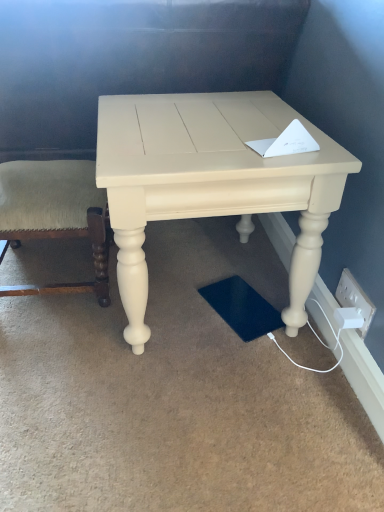
Describe the element at coordinates (210, 181) in the screenshot. The height and width of the screenshot is (512, 384). I see `matte cream table at center` at that location.

You are a GUI agent. You are given a task and a screenshot of the screen. Output one action in this format:
    pyautogui.click(x=<x>, y=<y>)
    Task: Click on the white plastic socket at lower right
    The height and width of the screenshot is (512, 384).
    Given the screenshot: What is the action you would take?
    pyautogui.click(x=349, y=317)

The height and width of the screenshot is (512, 384). I want to click on white plastic electric outlet at lower right, so click(355, 298).

From the image's perspective, is green fabric cushion at left under white plastic electric outlet at lower right?

No.

I want to click on electric outlet below the green fabric cushion at left (from the image's perspective), so click(355, 298).

Considering the sizes of green fabric cushion at left and white plastic electric outlet at lower right in the image, is green fabric cushion at left bigger or smaller than white plastic electric outlet at lower right?

Clearly, green fabric cushion at left is larger in size than white plastic electric outlet at lower right.

Is white plastic electric outlet at lower right bigger than green fabric cushion at left?

No.

From the image's perspective, does white plastic electric outlet at lower right appear lower than green fabric cushion at left?

Yes.

Is white plastic electric outlet at lower right inside the boundaries of green fabric cushion at left, or outside?

white plastic electric outlet at lower right is not inside green fabric cushion at left, it's outside.

From a real-world perspective, is white plastic electric outlet at lower right below green fabric cushion at left?

Incorrect, from a real-world perspective, white plastic electric outlet at lower right is higher than green fabric cushion at left.

Is white plastic electric outlet at lower right at the back of white plastic socket at lower right?

Yes.

From a real-world perspective, is white plastic socket at lower right above or below white plastic electric outlet at lower right?

In terms of real-world spatial position, white plastic socket at lower right is below white plastic electric outlet at lower right.

Is point (358, 311) positioned in front of point (355, 293)?

Yes, point (358, 311) is in front of point (355, 293).

Who is bigger, white plastic socket at lower right or white plastic electric outlet at lower right?

Bigger between the two is white plastic electric outlet at lower right.

Can you tell me how much white plastic electric outlet at lower right and matte cream table at center differ in facing direction?

0.982 degrees separate the facing orientations of white plastic electric outlet at lower right and matte cream table at center.

The width and height of the screenshot is (384, 512). What are the coordinates of `electric outlet below the matte cream table at center (from a real-world perspective)` in the screenshot? It's located at (355, 298).

Does white plastic electric outlet at lower right have a greater width compared to matte cream table at center?

No, white plastic electric outlet at lower right is not wider than matte cream table at center.

Considering the positions of points (366, 325) and (133, 287), is point (366, 325) farther from camera compared to point (133, 287)?

Yes, point (366, 325) is farther from viewer.

Is white plastic electric outlet at lower right facing away from white plastic socket at lower right?

Absolutely, white plastic electric outlet at lower right is directed away from white plastic socket at lower right.

From the picture: Between white plastic electric outlet at lower right and white plastic socket at lower right, which one has more height?

Standing taller between the two is white plastic electric outlet at lower right.

From the image's perspective, is white plastic electric outlet at lower right located above or below white plastic socket at lower right?

Clearly, from the image's perspective, white plastic electric outlet at lower right is above white plastic socket at lower right.

Is white plastic electric outlet at lower right wider than white plastic socket at lower right?

Incorrect, the width of white plastic electric outlet at lower right does not surpass that of white plastic socket at lower right.

Based on their sizes in the image, would you say matte cream table at center is bigger or smaller than white plastic electric outlet at lower right?

Clearly, matte cream table at center is larger in size than white plastic electric outlet at lower right.

Which of these two, matte cream table at center or white plastic electric outlet at lower right, is thinner?

Thinner between the two is white plastic electric outlet at lower right.

Does point (325, 169) come in front of point (348, 292)?

Yes, it is in front of point (348, 292).

Can you confirm if matte cream table at center is positioned to the left of white plastic electric outlet at lower right?

Correct, you'll find matte cream table at center to the left of white plastic electric outlet at lower right.

In the scene shown: Considering the sizes of white plastic socket at lower right and green fabric cushion at left in the image, is white plastic socket at lower right wider or thinner than green fabric cushion at left?

white plastic socket at lower right is thinner than green fabric cushion at left.

You are a GUI agent. You are given a task and a screenshot of the screen. Output one action in this format:
    pyautogui.click(x=<x>, y=<y>)
    Task: Click on the socket that appears below the green fabric cushion at left (from a real-world perspective)
    The height and width of the screenshot is (512, 384).
    Given the screenshot: What is the action you would take?
    pyautogui.click(x=349, y=317)

Does white plastic socket at lower right turn towards green fabric cushion at left?

No.

The image size is (384, 512). Find the location of `chair below the white plastic electric outlet at lower right (from a real-world perspective)`. chair below the white plastic electric outlet at lower right (from a real-world perspective) is located at coordinates (56, 208).

Find the location of a particular element. The width and height of the screenshot is (384, 512). electric outlet that appears below the green fabric cushion at left (from the image's perspective) is located at coordinates (355, 298).

When comparing their distances from white plastic electric outlet at lower right, does matte cream table at center or white plastic socket at lower right seem further?

Based on the image, matte cream table at center appears to be further to white plastic electric outlet at lower right.

Based on their spatial positions, is green fabric cushion at left or matte cream table at center closer to white plastic electric outlet at lower right?

matte cream table at center is closer to white plastic electric outlet at lower right.

From the image, which object appears to be farther from white plastic socket at lower right, green fabric cushion at left or white plastic electric outlet at lower right?

Based on the image, green fabric cushion at left appears to be further to white plastic socket at lower right.

Looking at the image, which one is located further to matte cream table at center, white plastic socket at lower right or green fabric cushion at left?

white plastic socket at lower right is positioned further to the anchor matte cream table at center.

Estimate the real-world distances between objects in this image. Which object is closer to white plastic electric outlet at lower right, white plastic socket at lower right or green fabric cushion at left?

The object closer to white plastic electric outlet at lower right is white plastic socket at lower right.

Looking at the image, which one is located further to green fabric cushion at left, matte cream table at center or white plastic socket at lower right?

white plastic socket at lower right is positioned further to the anchor green fabric cushion at left.

In the scene shown: When comparing their distances from white plastic electric outlet at lower right, does white plastic socket at lower right or matte cream table at center seem closer?

Among the two, white plastic socket at lower right is located nearer to white plastic electric outlet at lower right.

Which object lies further to the anchor point matte cream table at center, white plastic socket at lower right or white plastic electric outlet at lower right?

Based on the image, white plastic socket at lower right appears to be further to matte cream table at center.

Locate an element on the screen. The width and height of the screenshot is (384, 512). socket situated between green fabric cushion at left and white plastic electric outlet at lower right from left to right is located at coordinates (349, 317).

What are the coordinates of `table between green fabric cushion at left and white plastic electric outlet at lower right in the horizontal direction` in the screenshot? It's located at (210, 181).

Identify the location of table between green fabric cushion at left and white plastic socket at lower right from left to right. This screenshot has width=384, height=512. pos(210,181).

You are a GUI agent. You are given a task and a screenshot of the screen. Output one action in this format:
    pyautogui.click(x=<x>, y=<y>)
    Task: Click on the socket between matte cream table at center and white plastic electric outlet at lower right from left to right
    The height and width of the screenshot is (512, 384).
    Given the screenshot: What is the action you would take?
    pyautogui.click(x=349, y=317)